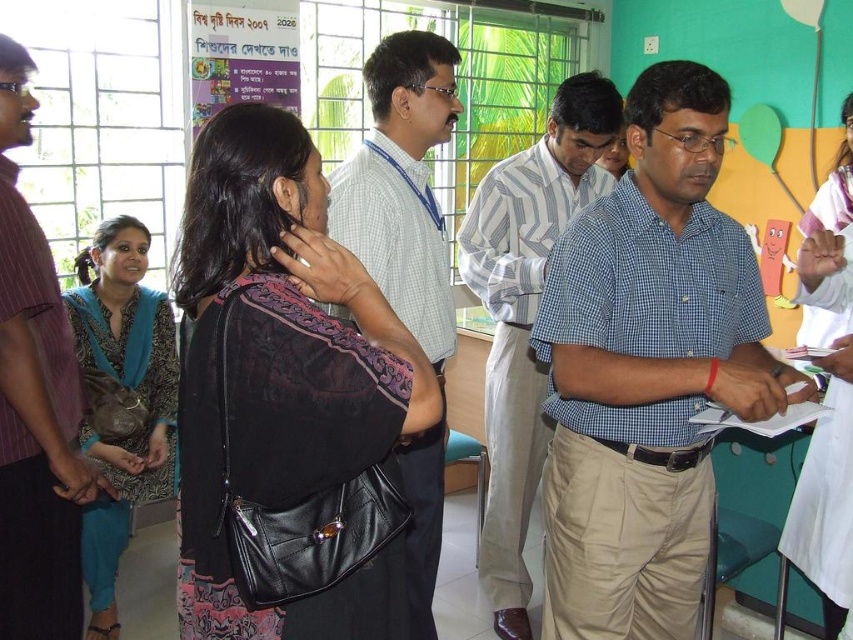
Question: Is light blue checkered shirt at center below teal fabric scarf at left?

Choices:
 (A) no
 (B) yes

Answer: (A)

Question: Can you confirm if black leather bag at center is smaller than blue checkered shirt at center?

Choices:
 (A) yes
 (B) no

Answer: (A)

Question: Which point is closer to the camera?

Choices:
 (A) striped cotton shirt at left
 (B) matte gray shirt at center

Answer: (A)

Question: Estimate the real-world distances between objects in this image. Which object is farther from the striped cotton shirt at left?

Choices:
 (A) teal fabric scarf at left
 (B) light blue checkered shirt at center
 (C) black leather bag at center

Answer: (B)

Question: Does blue checkered shirt at center have a smaller size compared to striped cotton shirt at left?

Choices:
 (A) yes
 (B) no

Answer: (B)

Question: Estimate the real-world distances between objects in this image. Which object is farther from the black leather bag at center?

Choices:
 (A) light blue checkered shirt at center
 (B) teal fabric scarf at left
 (C) striped cotton shirt at left

Answer: (B)